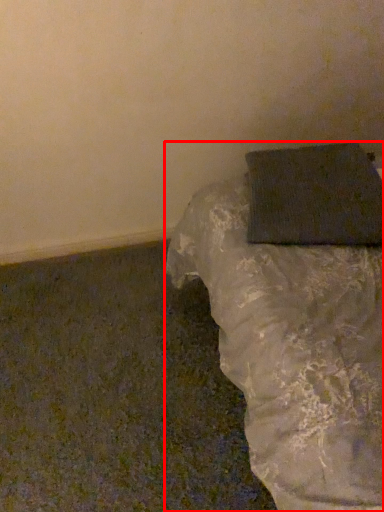
Question: From the image, what is the correct spatial relationship of furniture (annotated by the red box) in relation to wrapping paper?

Choices:
 (A) right
 (B) left

Answer: (A)